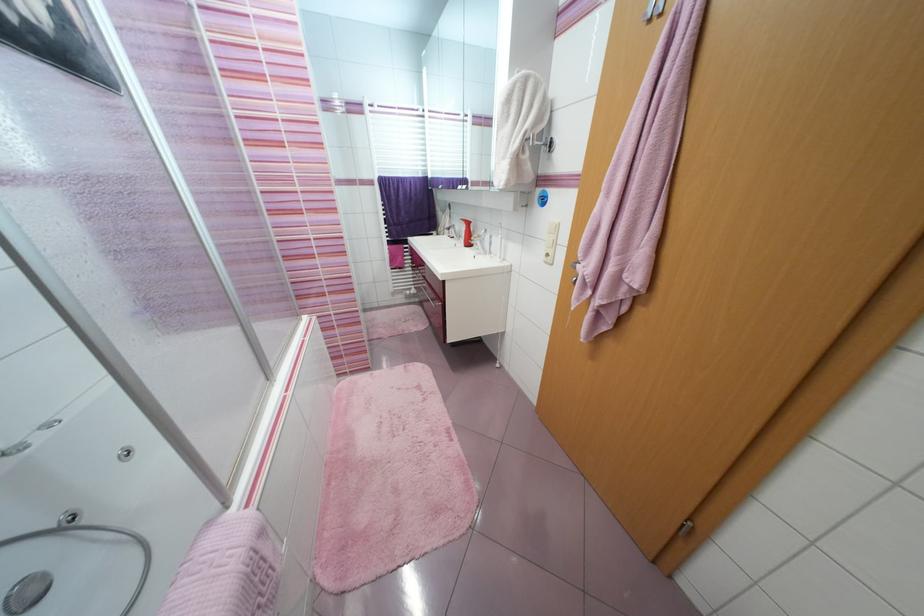
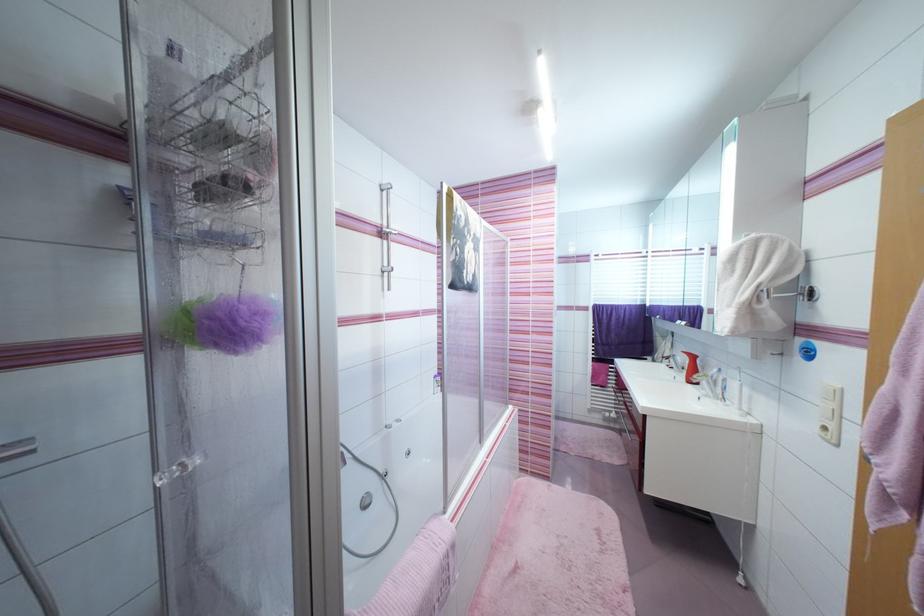
The point at (x=508, y=159) is marked in the first image. Where is the corresponding point in the second image?

(735, 307)